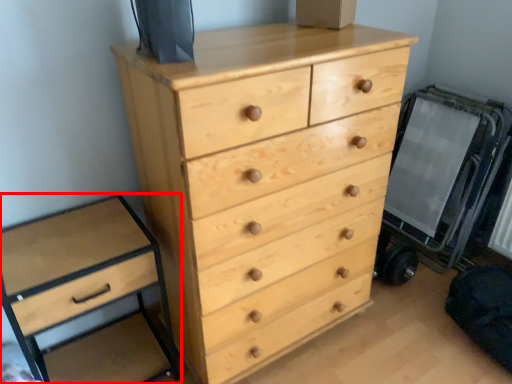
Question: From the image's perspective, what is the correct spatial positioning of chest of drawers (annotated by the red box) in reference to chest of drawers?

Choices:
 (A) below
 (B) above

Answer: (A)